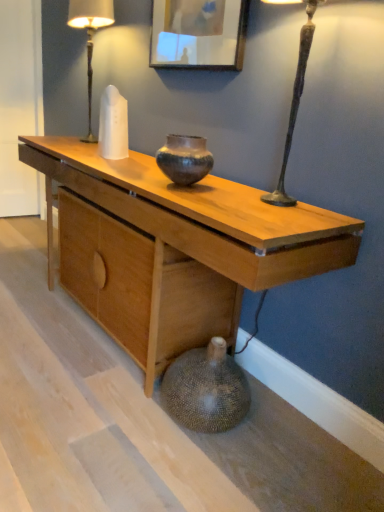
Where is `empty space that is to the right of earthy brown ceramic vase at center`? This screenshot has width=384, height=512. empty space that is to the right of earthy brown ceramic vase at center is located at coordinates (228, 193).